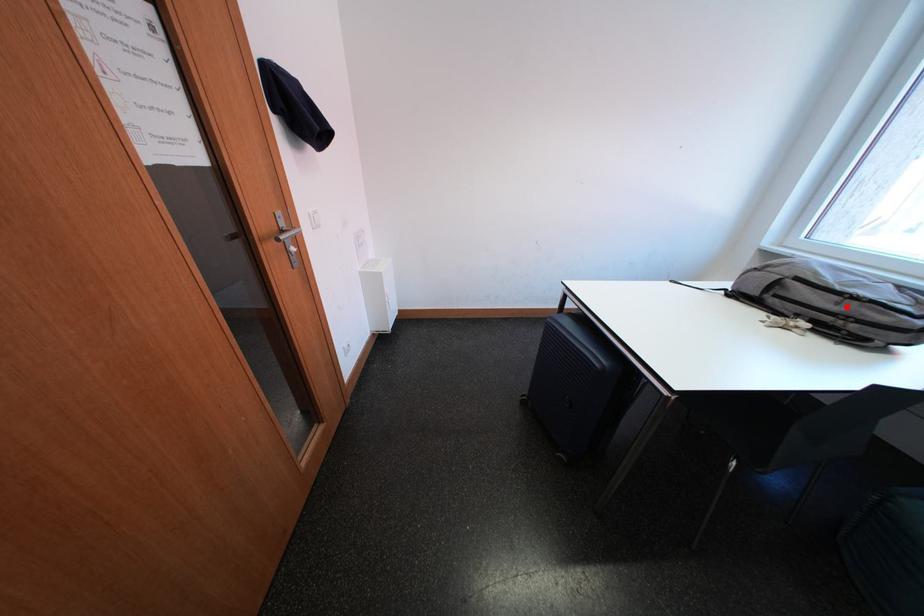
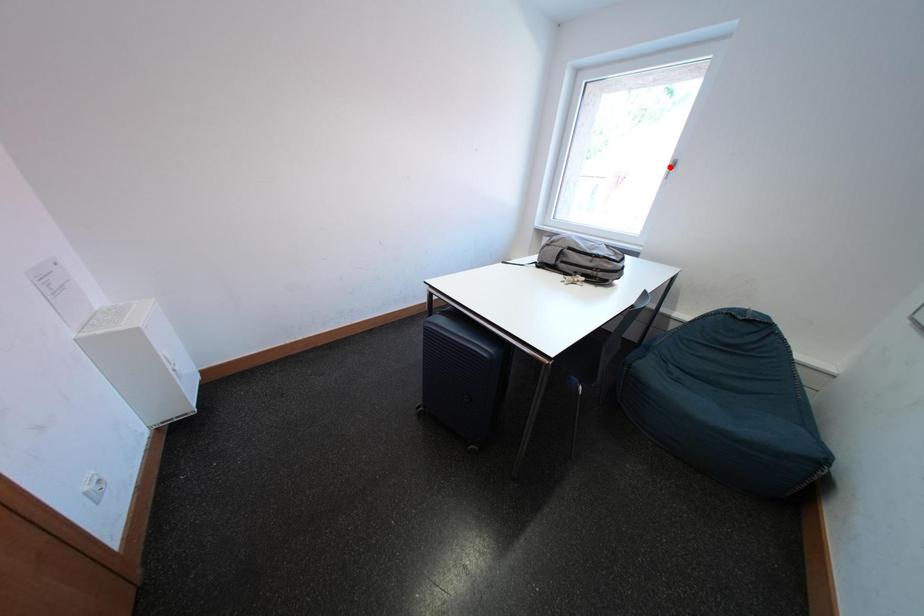
I am providing you with two images of the same scene from different viewpoints. A red point is marked on the first image and another point is marked on the second image. Does the point marked in image1 correspond to the same location as the one in image2?

No